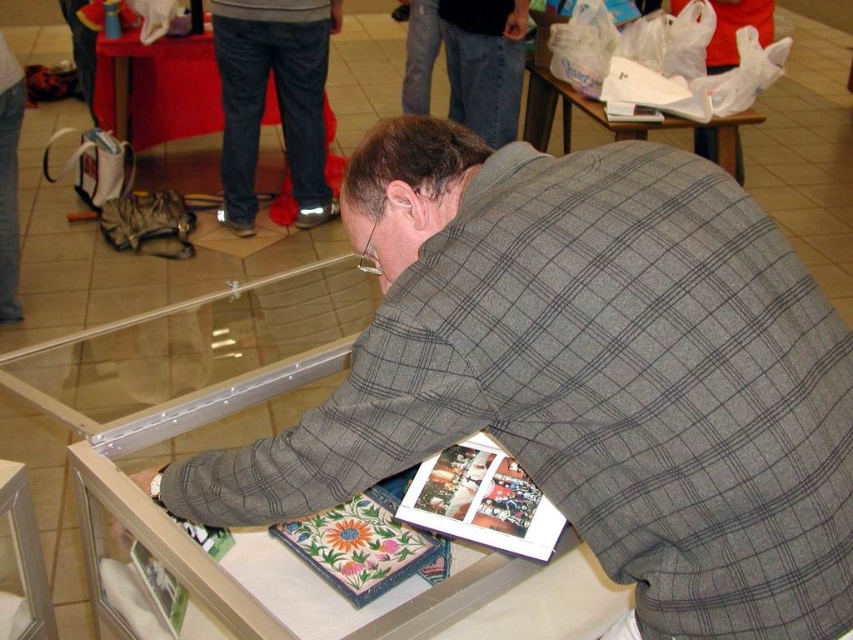
Question: Does matte paper magazine at center come in front of red fabric table at upper left?

Choices:
 (A) yes
 (B) no

Answer: (A)

Question: Does metallic glass display case at center appear over matte paper magazine at center?

Choices:
 (A) yes
 (B) no

Answer: (B)

Question: Which point is closer to the camera?

Choices:
 (A) red fabric table at upper left
 (B) metallic glass display case at center

Answer: (B)

Question: Among these points, which one is farthest from the camera?

Choices:
 (A) coord(173,612)
 (B) coord(737,148)
 (C) coord(236,570)
 (D) coord(109,88)

Answer: (D)

Question: Is floral fabric magazine at lower center positioned in front of printed paper magazine at lower left?

Choices:
 (A) no
 (B) yes

Answer: (B)

Question: Which point appears farthest from the camera in this image?

Choices:
 (A) 337,260
 (B) 631,131
 (C) 692,157
 (D) 206,532

Answer: (B)